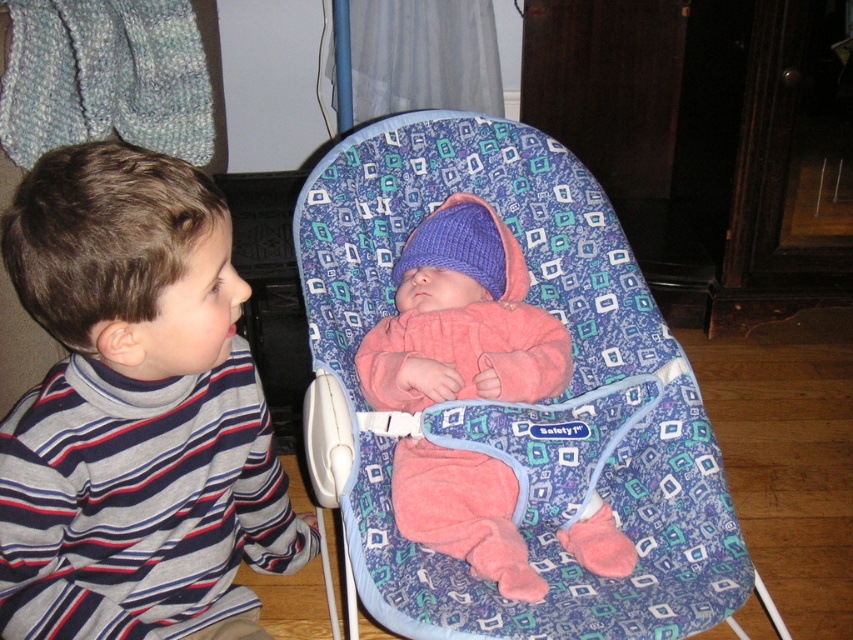
Question: Which point is closer to the camera?

Choices:
 (A) striped turtleneck shirt at left
 (B) pink fleece baby at center
 (C) blue patterned baby carrier at center

Answer: (A)

Question: Which point is closer to the camera?

Choices:
 (A) pink fleece baby at center
 (B) striped turtleneck shirt at left
 (C) blue patterned baby carrier at center

Answer: (B)

Question: Based on their relative distances, which object is nearer to the pink fleece baby at center?

Choices:
 (A) blue patterned baby carrier at center
 (B) striped turtleneck shirt at left

Answer: (A)

Question: Is striped turtleneck shirt at left bigger than pink fleece baby at center?

Choices:
 (A) no
 (B) yes

Answer: (B)

Question: Can you confirm if blue patterned baby carrier at center is positioned below striped turtleneck shirt at left?

Choices:
 (A) no
 (B) yes

Answer: (A)

Question: Is blue patterned baby carrier at center below pink fleece baby at center?

Choices:
 (A) no
 (B) yes

Answer: (A)